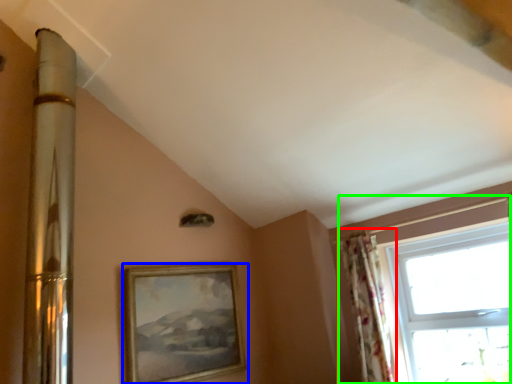
Question: Which object is the farthest from curtain (highlighted by a red box)? Choose among these: picture frame (highlighted by a blue box) or window (highlighted by a green box).

Choices:
 (A) picture frame
 (B) window

Answer: (A)